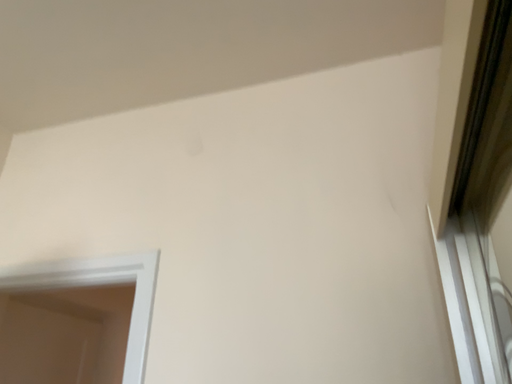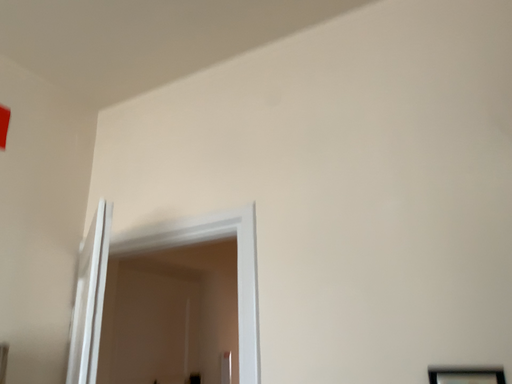
Question: Which way did the camera rotate in the video?

Choices:
 (A) rotated downward
 (B) rotated upward

Answer: (A)